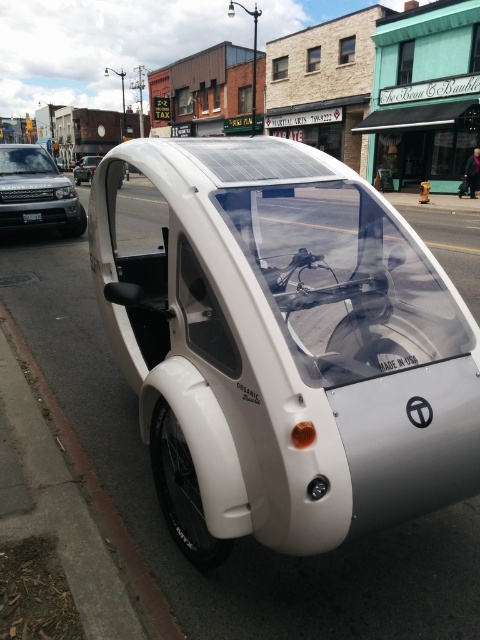
Between point (7, 163) and point (475, 189), which one is positioned behind?

Point (475, 189)

Between silver metallic suv at left and white matte coach at center, which one appears on the left side from the viewer's perspective?

silver metallic suv at left

Is point (29, 147) closer to viewer compared to point (474, 184)?

Yes, it is in front of point (474, 184).

Find the location of a particular element. silver metallic suv at left is located at coordinates (36, 189).

The image size is (480, 640). Describe the element at coordinates (36, 189) in the screenshot. I see `silver metallic suv at left` at that location.

Consider the image. Who is more distant from viewer, (12, 224) or (31, 214)?

Positioned behind is point (31, 214).

Where is `silver metallic suv at left`? The height and width of the screenshot is (640, 480). silver metallic suv at left is located at coordinates (36, 189).

Between white matte concept car at center and white matte coach at center, which one appears on the left side from the viewer's perspective?

white matte concept car at center is more to the left.

Does white matte concept car at center come behind white matte coach at center?

No.

At what (x,y) coordinates should I click in order to perform the action: click on white matte concept car at center. Please return your answer as a coordinate pair (x, y). Looking at the image, I should click on (285, 348).

Identify the location of white matte concept car at center. (285, 348).